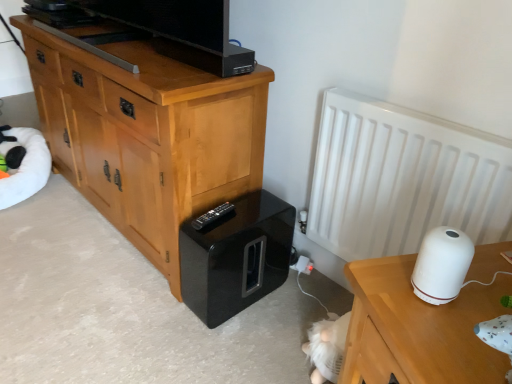
I want to click on glossy black speaker at lower center, so click(x=236, y=257).

The image size is (512, 384). What do you see at coordinates (212, 215) in the screenshot?
I see `black plastic remote at lower center` at bounding box center [212, 215].

This screenshot has height=384, width=512. I want to click on light brown wood chest of drawers at left, so click(x=147, y=136).

In order to click on white matte radiator at right in this screenshot , I will do `click(403, 179)`.

Image resolution: width=512 pixels, height=384 pixels. What are the coordinates of `glossy black speaker at lower center` in the screenshot? It's located at (236, 257).

Is light brown wood chest of drawers at left inside white matte radiator at right?

No, light brown wood chest of drawers at left is not a part of white matte radiator at right.

Looking at this image, considering the positions of objects white matte radiator at right and light brown wood chest of drawers at left in the image provided, who is more to the right, white matte radiator at right or light brown wood chest of drawers at left?

Positioned to the right is white matte radiator at right.

Find the location of a particular element. The height and width of the screenshot is (384, 512). chest of drawers lying on the left of white matte radiator at right is located at coordinates [x=147, y=136].

Does white matte radiator at right have a lesser width compared to light brown wood chest of drawers at left?

Correct, the width of white matte radiator at right is less than that of light brown wood chest of drawers at left.

From the image's perspective, does glossy black speaker at lower center appear lower than white glossy humidifier at right?

Yes, from the image's perspective, glossy black speaker at lower center is below white glossy humidifier at right.

Considering the sizes of glossy black speaker at lower center and white glossy humidifier at right in the image, is glossy black speaker at lower center taller or shorter than white glossy humidifier at right?

Clearly, glossy black speaker at lower center is taller compared to white glossy humidifier at right.

In terms of width, does glossy black speaker at lower center look wider or thinner when compared to white glossy humidifier at right?

In the image, glossy black speaker at lower center appears to be wider than white glossy humidifier at right.

Looking at this image, does glossy black speaker at lower center have a larger size compared to white glossy humidifier at right?

Correct, glossy black speaker at lower center is larger in size than white glossy humidifier at right.

Are light brown wood chest of drawers at left and white glossy humidifier at right far apart?

That's right, there is a large distance between light brown wood chest of drawers at left and white glossy humidifier at right.

Is light brown wood chest of drawers at left closer to the viewer compared to white glossy humidifier at right?

No, it is not.

Considering the sizes of light brown wood chest of drawers at left and white glossy humidifier at right in the image, is light brown wood chest of drawers at left wider or thinner than white glossy humidifier at right?

Considering their sizes, light brown wood chest of drawers at left looks broader than white glossy humidifier at right.

Could you tell me if light brown wood chest of drawers at left is turned towards white glossy humidifier at right?

No, light brown wood chest of drawers at left is not facing towards white glossy humidifier at right.

Considering the relative positions of white plush bean bag at left and white matte table at right in the image provided, is white plush bean bag at left to the right of white matte table at right from the viewer's perspective?

No.

Is point (1, 183) farther from camera compared to point (408, 348)?

Yes, point (1, 183) is farther from viewer.

From the image's perspective, is white plush bean bag at left positioned above or below white matte table at right?

Clearly, from the image's perspective, white plush bean bag at left is above white matte table at right.

Considering the relative sizes of white plush bean bag at left and white matte table at right in the image provided, is white plush bean bag at left wider than white matte table at right?

Yes.

Considering the sizes of objects white matte table at right and white matte radiator at right in the image provided, who is smaller, white matte table at right or white matte radiator at right?

Smaller between the two is white matte radiator at right.

Considering the points (484, 289) and (326, 127), which point is in front, point (484, 289) or point (326, 127)?

The point (484, 289) is closer.

What's the angular difference between white matte table at right and white matte radiator at right's facing directions?

28 degrees separate the facing orientations of white matte table at right and white matte radiator at right.

Can you confirm if white matte table at right is thinner than white matte radiator at right?

No, white matte table at right is not thinner than white matte radiator at right.

Which object is positioned more to the left, black plastic remote at lower center or glossy black speaker at lower center?

From the viewer's perspective, black plastic remote at lower center appears more on the left side.

From a real-world perspective, does black plastic remote at lower center stand above glossy black speaker at lower center?

Yes, from a real-world perspective, black plastic remote at lower center is on top of glossy black speaker at lower center.

Is black plastic remote at lower center positioned in front of glossy black speaker at lower center?

No.

Would you say black plastic remote at lower center is inside or outside glossy black speaker at lower center?

black plastic remote at lower center is located beyond the bounds of glossy black speaker at lower center.

Considering the sizes of objects glossy black speaker at lower center and white matte radiator at right in the image provided, who is thinner, glossy black speaker at lower center or white matte radiator at right?

Thinner between the two is white matte radiator at right.

From a real-world perspective, is glossy black speaker at lower center positioned above or below white matte radiator at right?

From a real-world perspective, glossy black speaker at lower center is physically below white matte radiator at right.

Between glossy black speaker at lower center and white matte radiator at right, which one appears on the left side from the viewer's perspective?

Positioned to the left is glossy black speaker at lower center.

Which of these two, glossy black speaker at lower center or white matte radiator at right, is bigger?

white matte radiator at right is bigger.

The height and width of the screenshot is (384, 512). In order to click on the chest of drawers above the white matte radiator at right (from the image's perspective) in this screenshot , I will do `click(147, 136)`.

I want to click on home appliance below the white glossy humidifier at right (from a real-world perspective), so coord(236,257).

Based on their spatial positions, is light brown wood chest of drawers at left or white glossy humidifier at right closer to white plush bean bag at left?

Among the two, light brown wood chest of drawers at left is located nearer to white plush bean bag at left.

Looking at the image, which one is located closer to light brown wood chest of drawers at left, white matte radiator at right or white glossy humidifier at right?

white matte radiator at right lies closer to light brown wood chest of drawers at left than the other object.

Estimate the real-world distances between objects in this image. Which object is further from white plush bean bag at left, white glossy humidifier at right or black plastic remote at lower center?

white glossy humidifier at right lies further to white plush bean bag at left than the other object.

Looking at the image, which one is located closer to white plush bean bag at left, white matte table at right or white matte radiator at right?

white matte radiator at right is closer to white plush bean bag at left.

Based on their spatial positions, is black plastic remote at lower center or white plush bean bag at left further from light brown wood chest of drawers at left?

The object further to light brown wood chest of drawers at left is white plush bean bag at left.

Which object lies nearer to the anchor point white matte radiator at right, white matte table at right or white plush bean bag at left?

The object closer to white matte radiator at right is white matte table at right.

Considering their positions, is black plastic remote at lower center positioned closer to white matte radiator at right than glossy black speaker at lower center?

The object closer to white matte radiator at right is glossy black speaker at lower center.

Based on their spatial positions, is glossy black speaker at lower center or black plastic remote at lower center closer to white plush bean bag at left?

The object closer to white plush bean bag at left is glossy black speaker at lower center.

Locate an element on the screen. chest of drawers between white plush bean bag at left and black plastic remote at lower center in the horizontal direction is located at coordinates (147, 136).

This screenshot has height=384, width=512. Find the location of `remote between light brown wood chest of drawers at left and glossy black speaker at lower center`. remote between light brown wood chest of drawers at left and glossy black speaker at lower center is located at coordinates [212, 215].

The width and height of the screenshot is (512, 384). Find the location of `home appliance located between black plastic remote at lower center and white matte radiator at right in the left-right direction`. home appliance located between black plastic remote at lower center and white matte radiator at right in the left-right direction is located at coordinates (236, 257).

Locate an element on the screen. remote between light brown wood chest of drawers at left and white matte radiator at right in the horizontal direction is located at coordinates (212, 215).